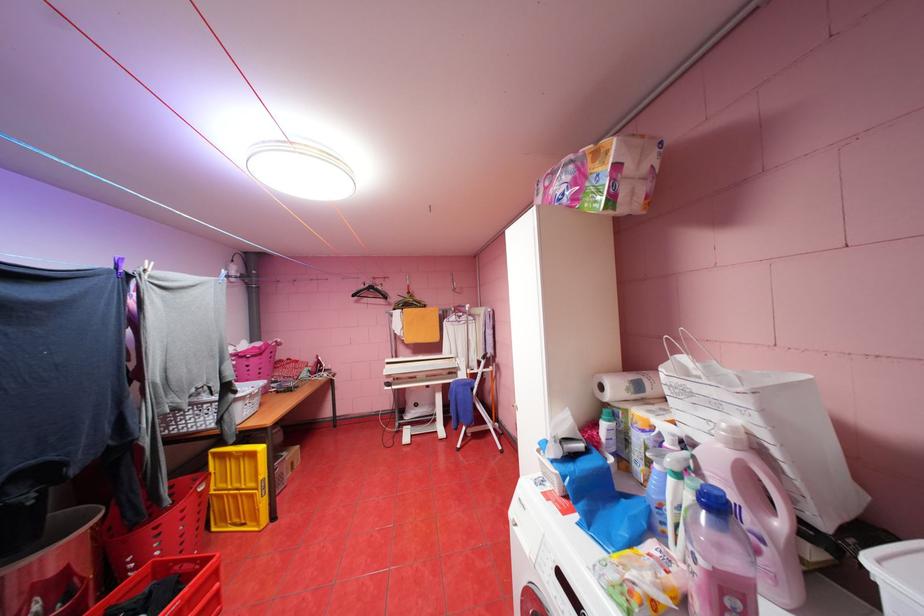
Find where to squeez the blue clothespin. Please return your answer as a coordinate pair (x, y).

(718, 557)